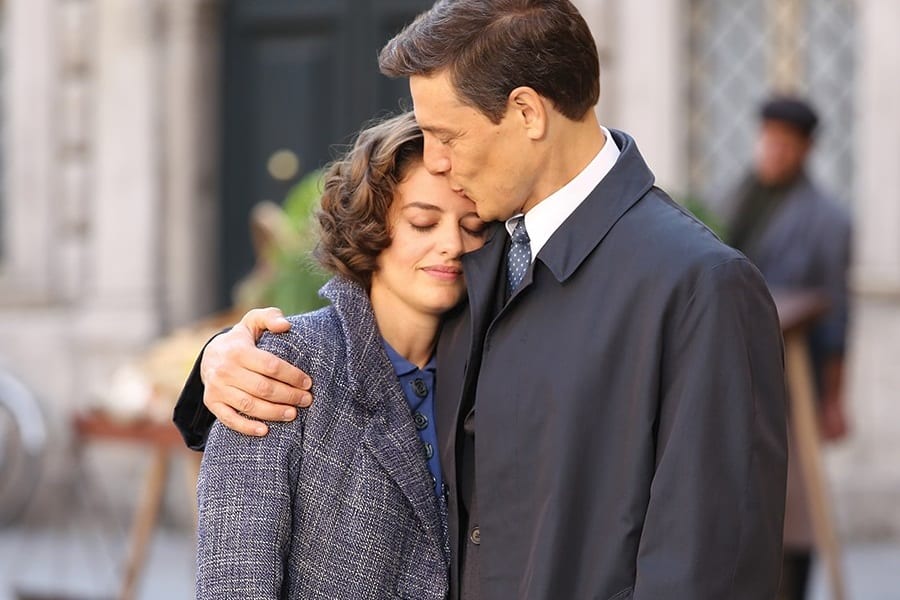
The image size is (900, 600). What are the coordinates of `black door` in the screenshot? It's located at (274, 90).